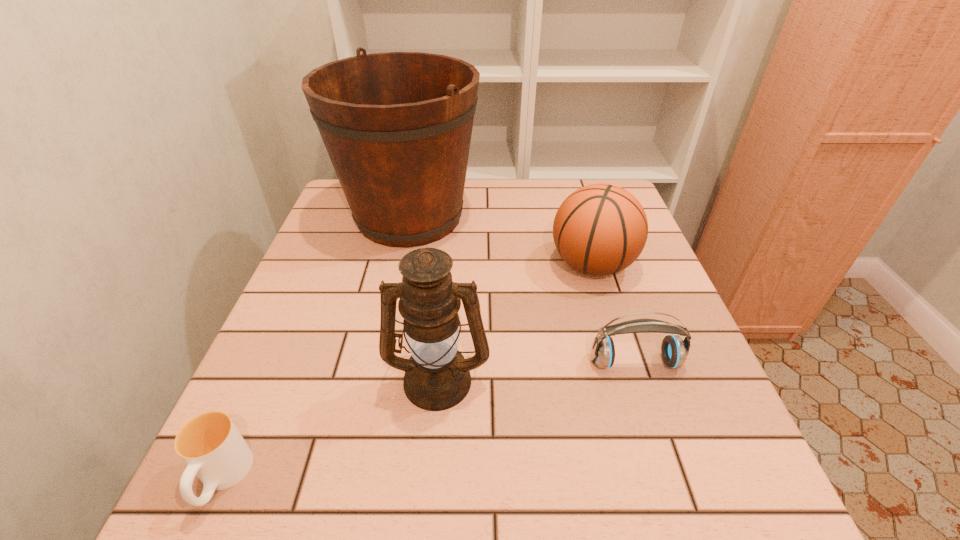
Where is `object that stands as the second closest to the bucket`? This screenshot has height=540, width=960. object that stands as the second closest to the bucket is located at coordinates (437, 377).

Find the location of a particular element. The height and width of the screenshot is (540, 960). the closest object to the basketball is located at coordinates (674, 350).

At what (x,y) coordinates should I click in order to perform the action: click on vacant space that satisfies the following two spatial constraints: 1. on the front side of the bucket; 2. on the right side of the oil lamp. Please return your answer as a coordinate pair (x, y). This screenshot has width=960, height=540. Looking at the image, I should click on (374, 378).